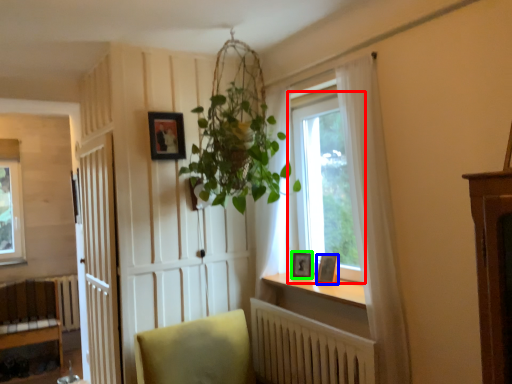
Question: Which object is the farthest from window (highlighted by a red box)? Choose among these: picture frame (highlighted by a blue box) or picture frame (highlighted by a green box).

Choices:
 (A) picture frame
 (B) picture frame

Answer: (A)